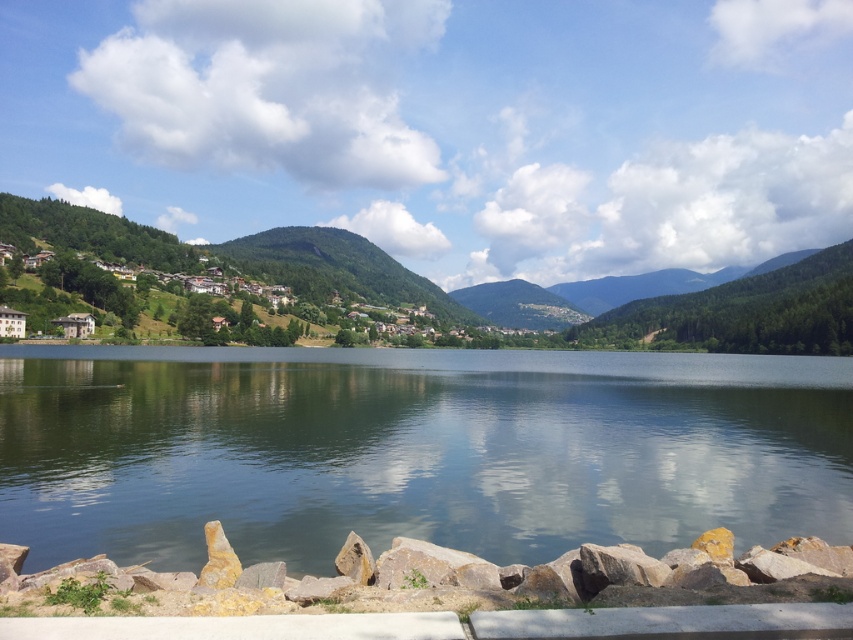
Which of these two, smooth water at center or green forested mountain at left, stands taller?

With more height is green forested mountain at left.

Between point (439, 520) and point (599, 316), which one is positioned in front?

Point (439, 520) is more forward.

Who is more distant from viewer, (22, 348) or (815, 268)?

Positioned behind is point (815, 268).

Where is `smooth water at center`? This screenshot has width=853, height=640. smooth water at center is located at coordinates (415, 451).